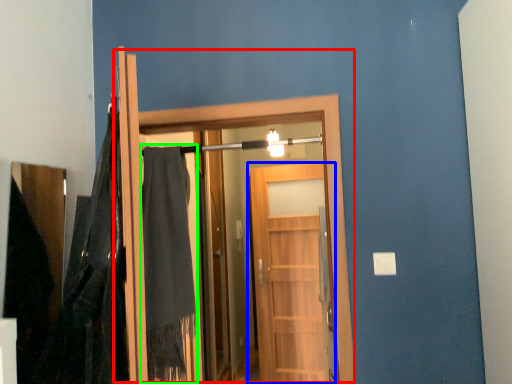
Question: Based on their relative distances, which object is nearer to door (highlighted by a red box)? Choose from door (highlighted by a blue box) and robe (highlighted by a green box).

Choices:
 (A) door
 (B) robe

Answer: (B)